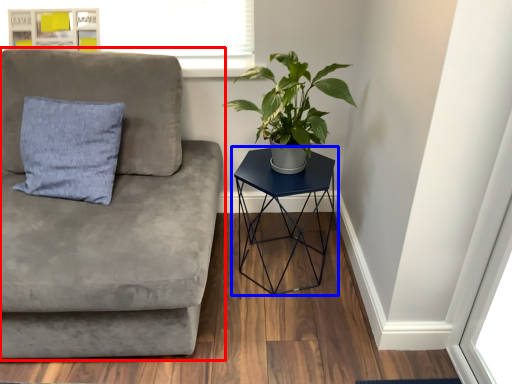
Question: Among these objects, which one is nearest to the camera, studio couch (highlighted by a red box) or table (highlighted by a blue box)?

Choices:
 (A) studio couch
 (B) table

Answer: (A)